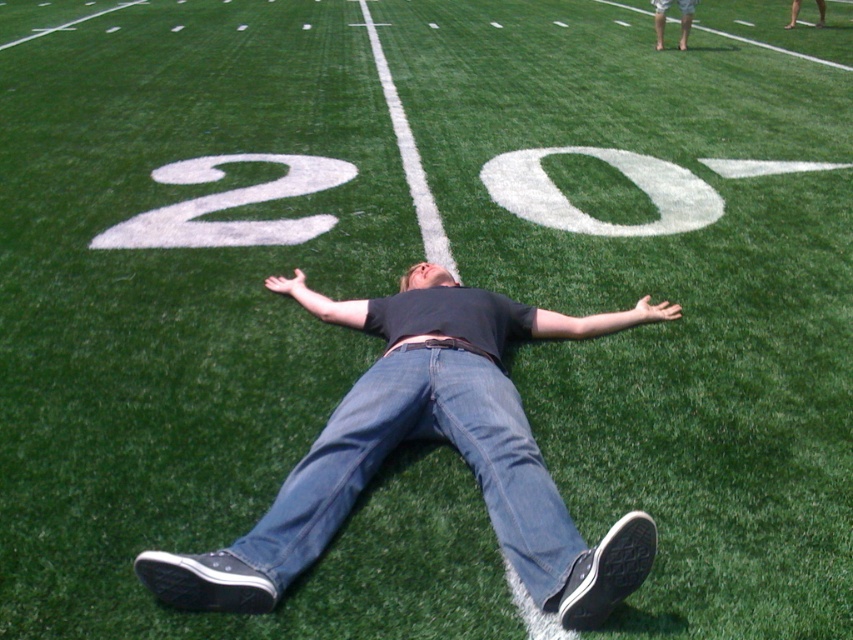
Does denim jeans at center have a greater height compared to matte black belt at center?

Correct, denim jeans at center is much taller as matte black belt at center.

This screenshot has height=640, width=853. In order to click on denim jeans at center in this screenshot , I will do [427, 436].

This screenshot has height=640, width=853. What are the coordinates of `denim jeans at center` in the screenshot? It's located at (427, 436).

This screenshot has width=853, height=640. Identify the location of denim jeans at center. [427, 436].

Who is positioned more to the right, white painted number at center or smooth skin legs at upper right?

From the viewer's perspective, smooth skin legs at upper right appears more on the right side.

Does white painted number at center appear on the right side of smooth skin legs at upper right?

No, white painted number at center is not to the right of smooth skin legs at upper right.

Between point (306, 157) and point (660, 17), which one is positioned in front?

Positioned in front is point (306, 157).

The image size is (853, 640). Find the location of `white painted number at center`. white painted number at center is located at coordinates (229, 205).

Can you confirm if smooth skin legs at upper right is wider than matte black belt at center?

Yes, smooth skin legs at upper right is wider than matte black belt at center.

In the scene shown: Who is more distant from viewer, (686, 4) or (486, 358)?

Positioned behind is point (686, 4).

Where is `smooth skin legs at upper right`? This screenshot has height=640, width=853. smooth skin legs at upper right is located at coordinates (685, 19).